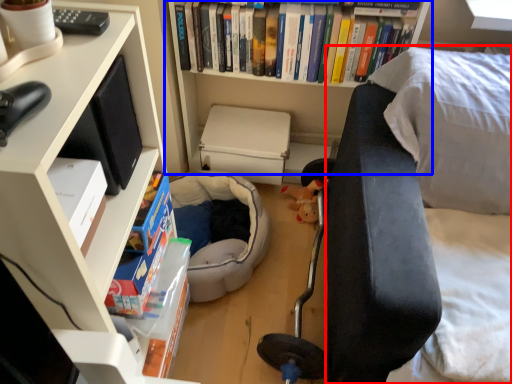
Question: Among these objects, which one is nearest to the camera, couch (highlighted by a red box) or bookcase (highlighted by a blue box)?

Choices:
 (A) couch
 (B) bookcase

Answer: (A)